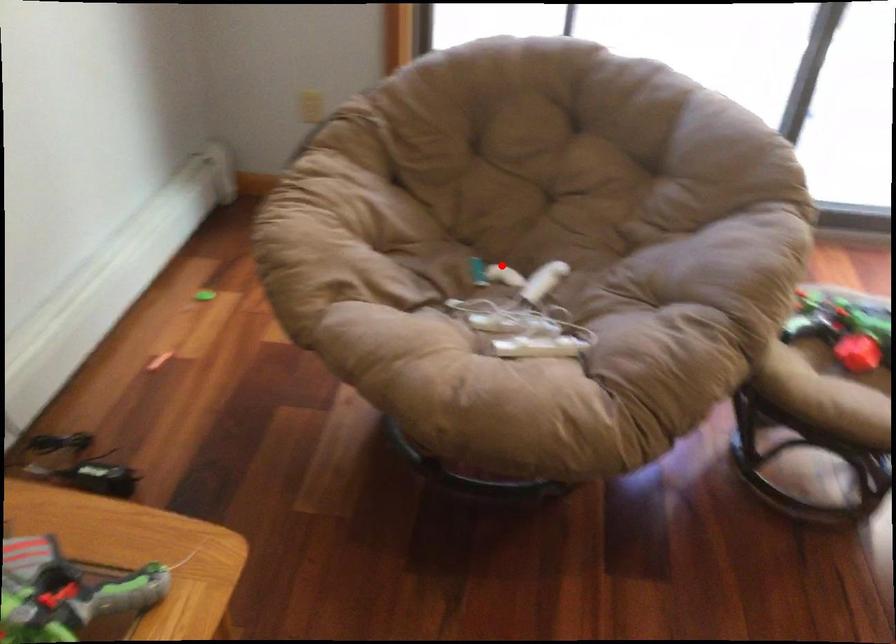
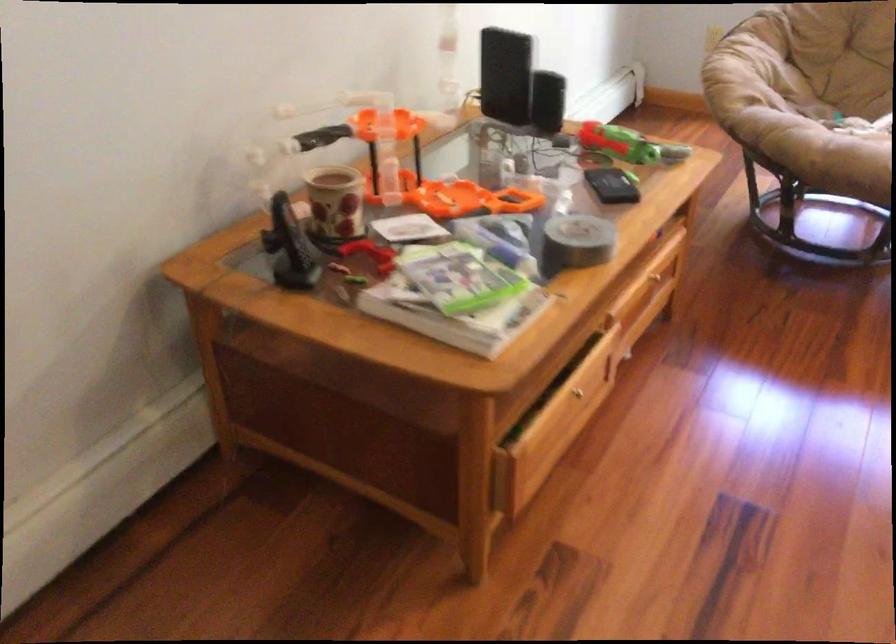
Question: I am providing you with two images of the same scene from different viewpoints. A red point is shown in image1. For the corresponding object point in image2, is it positioned nearer or farther from the camera?

Choices:
 (A) Nearer
 (B) Farther

Answer: (B)